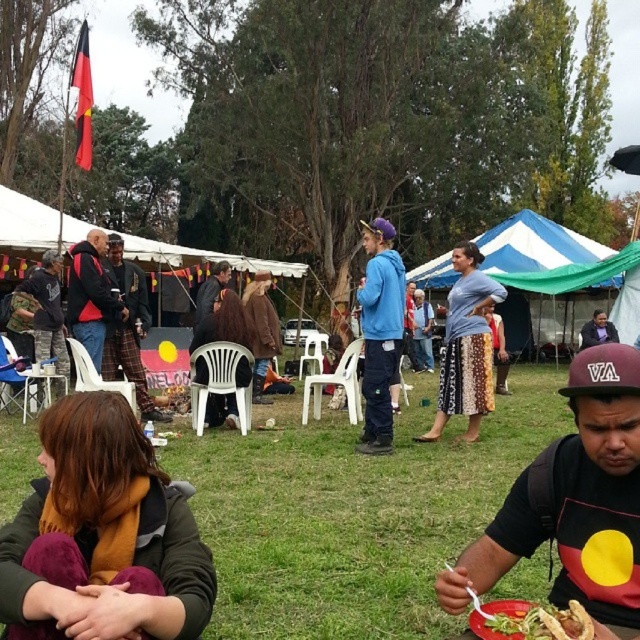
From the picture: You are a photographer trying to capture a candid shot of the maroon fabric cap at center and the plaid fabric pants at center in the scene. Given that your camera has a maximum focus range of 5 meters, will you be able to get both subjects in focus simultaneously?

The maroon fabric cap at center is 5.81 meters away from plaid fabric pants at center. Since the distance between them exceeds the camera lens focus range of 5 meters, you won unable to capture both subjects in focus at the same time.

You are standing in the park and see the brown wool scarf at lower left and the plaid fabric pants at center. According to their positions, which one is located to the right side?

The brown wool scarf at lower left is to the right of plaid fabric pants at center, so the brown wool scarf at lower left is located to the right side.